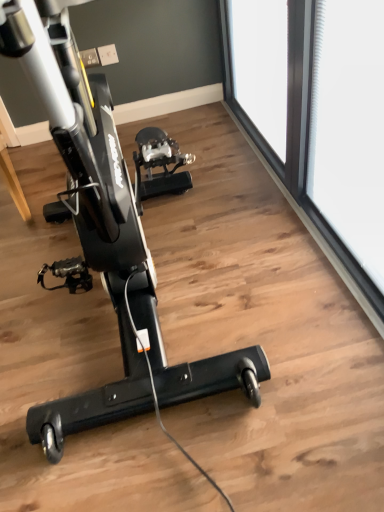
Where is `black matte stationary bicycle at center`? This screenshot has height=512, width=384. black matte stationary bicycle at center is located at coordinates (107, 233).

The width and height of the screenshot is (384, 512). What do you see at coordinates (107, 233) in the screenshot? I see `black matte stationary bicycle at center` at bounding box center [107, 233].

You are a GUI agent. You are given a task and a screenshot of the screen. Output one action in this format:
    pyautogui.click(x=<x>, y=<y>)
    Task: Click on the black matte stationary bicycle at center
    The width and height of the screenshot is (384, 512).
    Given the screenshot: What is the action you would take?
    pyautogui.click(x=107, y=233)